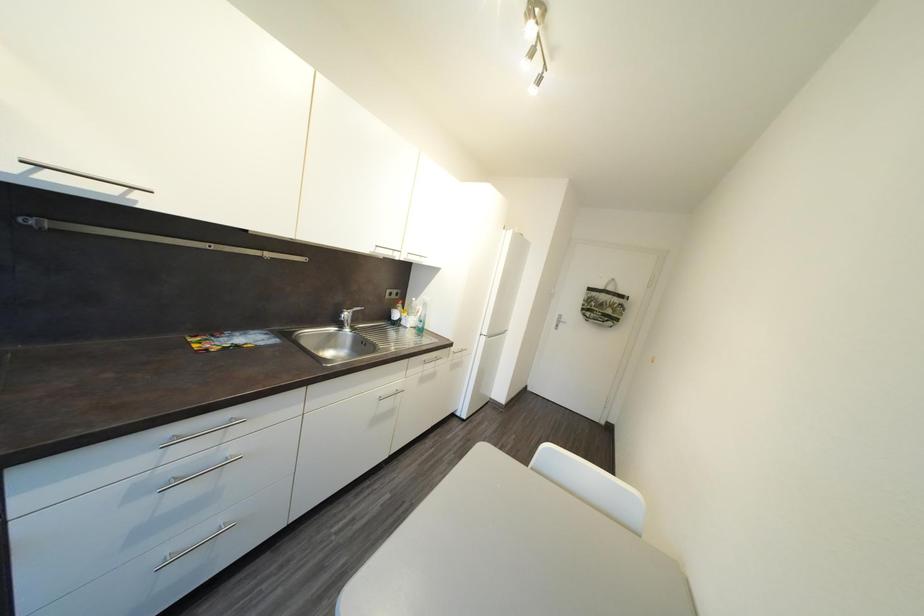
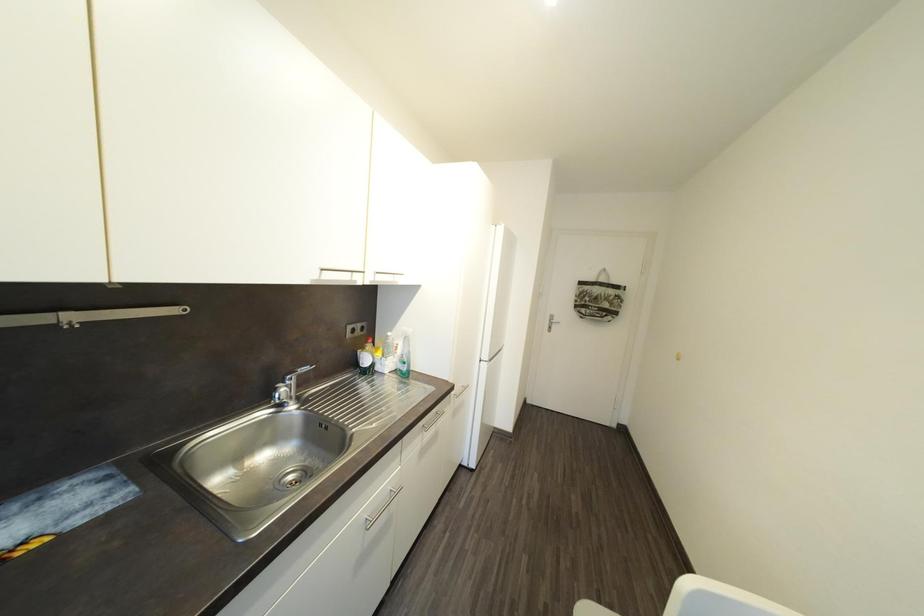
Question: What movement of the cameraman would produce the second image?

Choices:
 (A) Left
 (B) Right
 (C) Forward
 (D) Backward

Answer: (C)